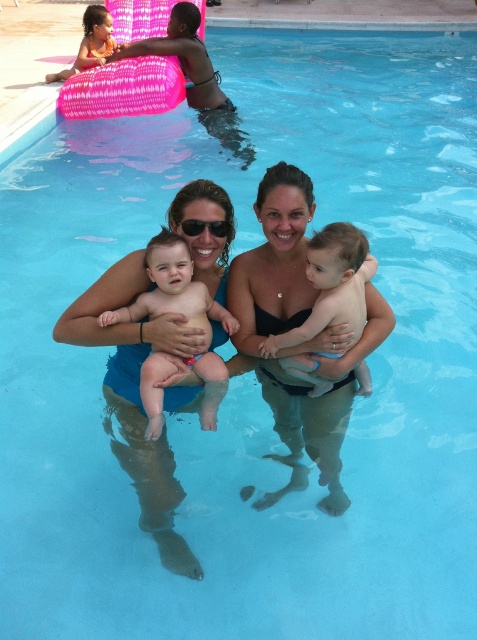
Question: Which point is closer to the camera?

Choices:
 (A) (320, 330)
 (B) (325, 339)
 (C) (205, 401)
 (D) (224, 198)

Answer: (A)

Question: Is blue fabric at center below nude skin baby at center?

Choices:
 (A) no
 (B) yes

Answer: (B)

Question: Can you confirm if blue fabric at center is positioned to the right of smooth skin baby at center?

Choices:
 (A) yes
 (B) no

Answer: (B)

Question: Among these points, which one is farthest from the camera?

Choices:
 (A) [185, 317]
 (B) [294, 465]
 (C) [349, 308]

Answer: (B)

Question: Which is nearer to the black plastic goggles at center?

Choices:
 (A) black matte swimsuit at center
 (B) smooth skin baby at center

Answer: (B)

Question: Is blue fabric at center further to camera compared to nude skin baby at center?

Choices:
 (A) no
 (B) yes

Answer: (B)